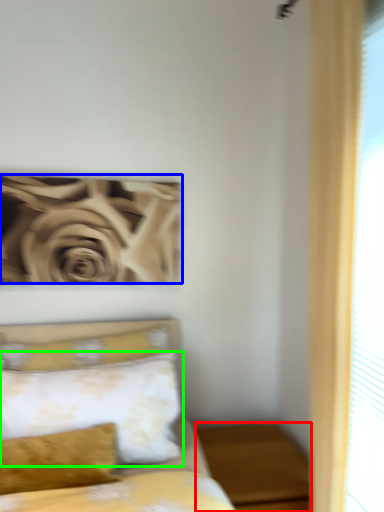
Question: Estimate the real-world distances between objects in this image. Which object is closer to nightstand (highlighted by a red box), rose (highlighted by a blue box) or pillow (highlighted by a green box)?

Choices:
 (A) rose
 (B) pillow

Answer: (B)